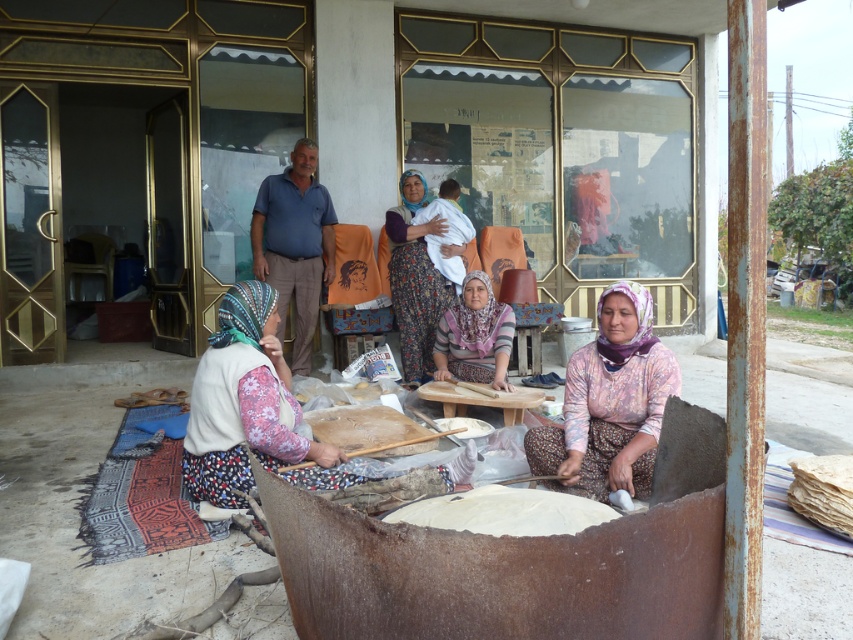
In the scene shown: You are a photographer taking a picture of the scene. You notice the floral fabric headscarf at lower left and the pink fabric headscarf at center. Which headscarf is closer to the camera?

The floral fabric headscarf at lower left is positioned under the pink fabric headscarf at center, so the pink fabric headscarf at center is closer to the camera.

You are standing in front of the large metal bowl with dough and want to move towards the building with gold metalwork. Which point, point (252, 346) or point (410, 515), is closer to your current position?

Point (252, 346) is closer to your current position because it is further to the viewer than point (410, 515).